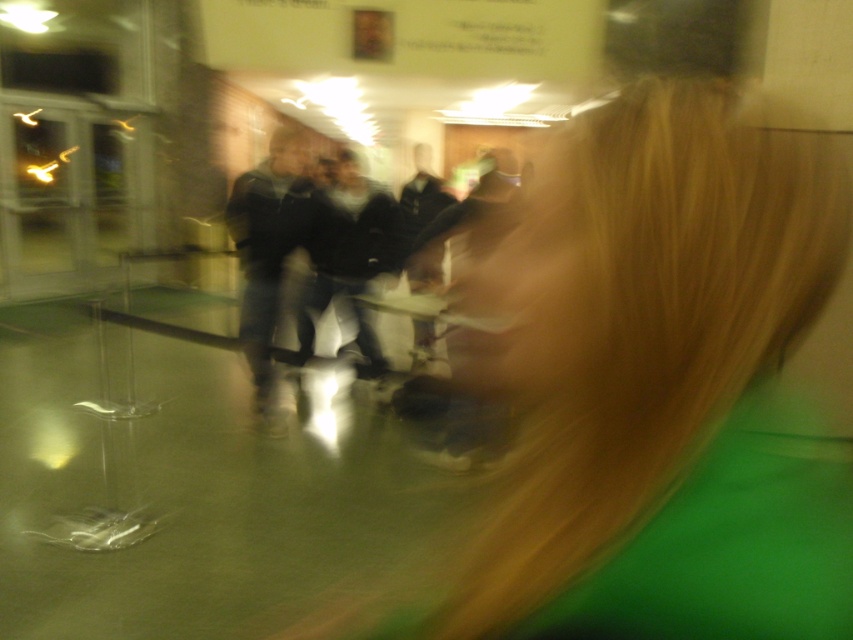
Question: Can you confirm if blonde hair at center is thinner than dark gray jacket at center?

Choices:
 (A) yes
 (B) no

Answer: (B)

Question: From the image, what is the correct spatial relationship of blonde hair at center in relation to dark gray jacket at center?

Choices:
 (A) above
 (B) below

Answer: (B)

Question: Can you confirm if blonde hair at center is smaller than dark gray jacket at center?

Choices:
 (A) yes
 (B) no

Answer: (A)